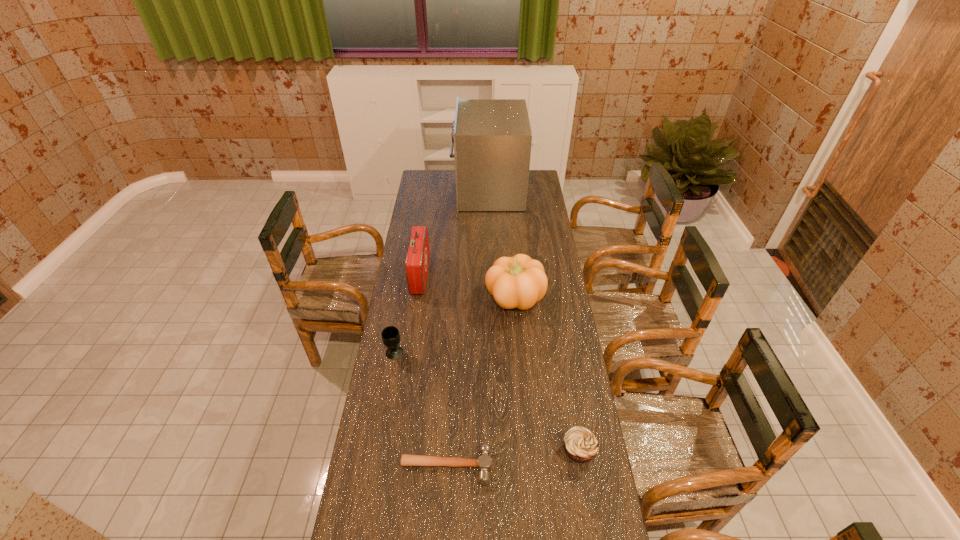
This screenshot has height=540, width=960. What are the coordinates of `free location that satisfies the following two spatial constraints: 1. on the front side of the pumpkin; 2. on the right side of the fifth tallest object` in the screenshot? It's located at (x=527, y=450).

Where is `free point that satisfies the following two spatial constraints: 1. on the side of the first-aid kit with the first aid cross symbol; 2. on the front side of the chalice`? The image size is (960, 540). free point that satisfies the following two spatial constraints: 1. on the side of the first-aid kit with the first aid cross symbol; 2. on the front side of the chalice is located at coordinates (409, 353).

The image size is (960, 540). What are the coordinates of `vacant area in the image that satisfies the following two spatial constraints: 1. on the side of the first-aid kit with the first aid cross symbol; 2. on the left side of the fifth tallest object` in the screenshot? It's located at (395, 450).